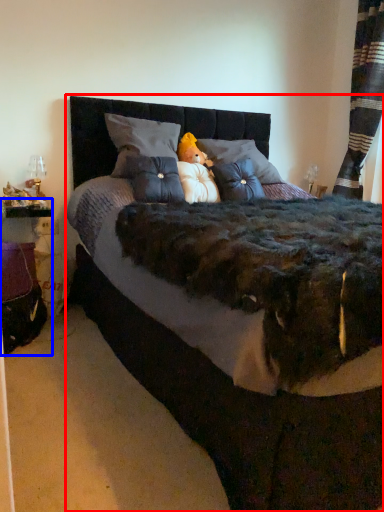
Question: Which point is further to the camera, bed (highlighted by a red box) or table (highlighted by a blue box)?

Choices:
 (A) bed
 (B) table

Answer: (B)